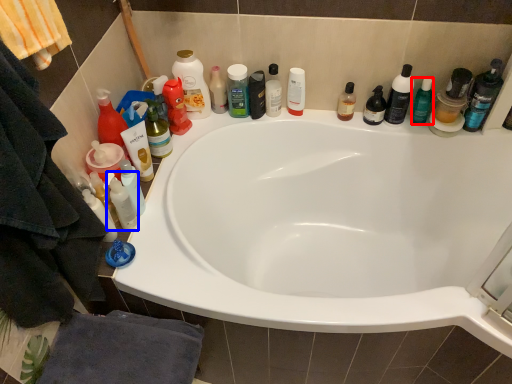
Question: Which point is closer to the camera, toiletry (highlighted by a red box) or mouthwash (highlighted by a blue box)?

Choices:
 (A) toiletry
 (B) mouthwash

Answer: (B)